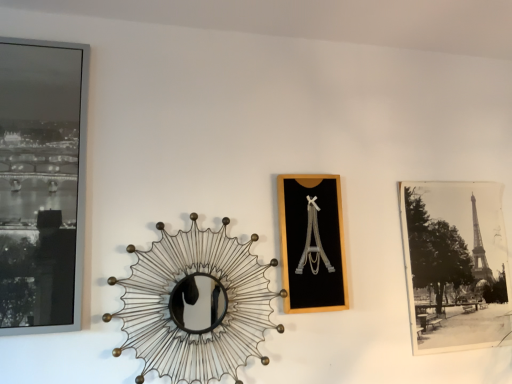
Question: From a real-world perspective, is black matte picture frame at center, which appears as the 2th picture frame when viewed from the front, below matte black frame at left, the 1th picture frame from the front?

Choices:
 (A) yes
 (B) no

Answer: (A)

Question: Considering the relative sizes of black matte picture frame at center, positioned as the 2th picture frame in left-to-right order, and matte black frame at left, acting as the 3th picture frame starting from the right, in the image provided, is black matte picture frame at center, positioned as the 2th picture frame in left-to-right order, smaller than matte black frame at left, acting as the 3th picture frame starting from the right,?

Choices:
 (A) no
 (B) yes

Answer: (B)

Question: Are black matte picture frame at center, which appears as the 2th picture frame when viewed from the front, and matte black frame at left, acting as the 3th picture frame starting from the right, beside each other?

Choices:
 (A) no
 (B) yes

Answer: (A)

Question: Is the depth of black matte picture frame at center, which appears as the 2th picture frame when viewed from the front, less than that of matte black frame at left, acting as the 3th picture frame starting from the right?

Choices:
 (A) no
 (B) yes

Answer: (A)

Question: Can you confirm if black matte picture frame at center, the second picture frame viewed from the back, is wider than matte black frame at left, the 1th picture frame when ordered from left to right?

Choices:
 (A) no
 (B) yes

Answer: (A)

Question: Does black matte picture frame at center, positioned as the 2th picture frame in left-to-right order, have a greater height compared to matte black frame at left, the third picture frame in the back-to-front sequence?

Choices:
 (A) no
 (B) yes

Answer: (A)

Question: Is black matte picture frame at center, which appears as the 2th picture frame when viewed from the front, taller than metallic wire sunburst mirror at center?

Choices:
 (A) no
 (B) yes

Answer: (A)

Question: From a real-world perspective, is black matte picture frame at center, which appears as the 2th picture frame when viewed from the front, positioned under metallic wire sunburst mirror at center based on gravity?

Choices:
 (A) yes
 (B) no

Answer: (B)

Question: Considering the relative sizes of black matte picture frame at center, the second picture frame viewed from the back, and metallic wire sunburst mirror at center in the image provided, is black matte picture frame at center, the second picture frame viewed from the back, shorter than metallic wire sunburst mirror at center?

Choices:
 (A) no
 (B) yes

Answer: (B)

Question: Can you confirm if black matte picture frame at center, the second picture frame viewed from the back, is positioned to the left of metallic wire sunburst mirror at center?

Choices:
 (A) yes
 (B) no

Answer: (B)

Question: Is the position of black matte picture frame at center, the second picture frame viewed from the back, more distant than that of metallic wire sunburst mirror at center?

Choices:
 (A) no
 (B) yes

Answer: (B)

Question: Does black matte picture frame at center, the second picture frame viewed from the back, appear on the right side of metallic wire sunburst mirror at center?

Choices:
 (A) no
 (B) yes

Answer: (B)

Question: Considering the relative sizes of metallic wire sunburst mirror at center and black paper photo at right, which is the 1th picture frame in back-to-front order, in the image provided, is metallic wire sunburst mirror at center bigger than black paper photo at right, which is the 1th picture frame in back-to-front order,?

Choices:
 (A) yes
 (B) no

Answer: (A)